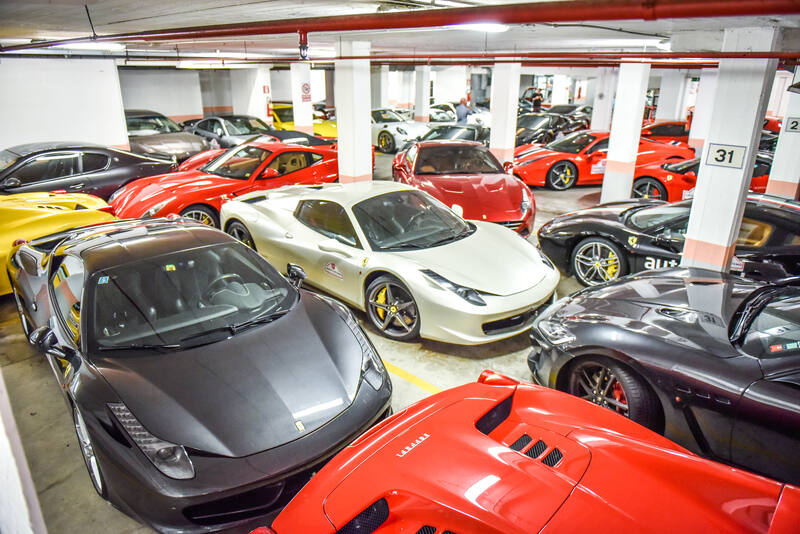
You are a GUI agent. You are given a task and a screenshot of the screen. Output one action in this format:
    pyautogui.click(x=<x>, y=<y>)
    Task: Click on the lights
    The height and width of the screenshot is (534, 800).
    Given the screenshot: What is the action you would take?
    pyautogui.click(x=493, y=29), pyautogui.click(x=100, y=45), pyautogui.click(x=666, y=42)